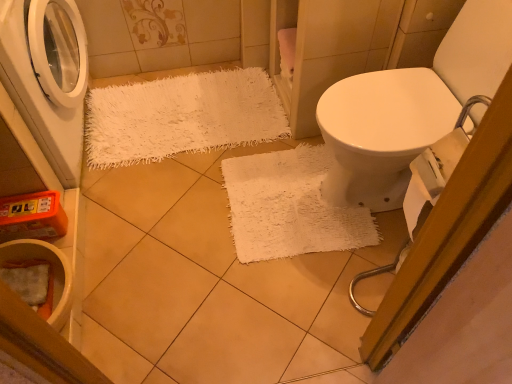
What do you see at coordinates (51, 273) in the screenshot?
I see `white ceramic toilet bowl at lower left` at bounding box center [51, 273].

Where is `white ceramic toilet bowl at lower left`? Image resolution: width=512 pixels, height=384 pixels. white ceramic toilet bowl at lower left is located at coordinates (51, 273).

Consider the image. Which of these two, white shaggy rug at upper left or white matte washing machine at left, stands taller?

With more height is white matte washing machine at left.

Is the surface of white shaggy rug at upper left in direct contact with white matte washing machine at left?

white shaggy rug at upper left is not next to white matte washing machine at left, and they're not touching.

From a real-world perspective, who is located lower, white shaggy rug at upper left or white matte washing machine at left?

white shaggy rug at upper left is physically lower.

From a real-world perspective, which object rests below the other?

In real-world perspective, white shaggy rug at upper left is lower.

Would you say white matte washing machine at left is a long distance from white shaggy rug at upper left?

No, white matte washing machine at left is not far from white shaggy rug at upper left.

Who is bigger, white matte washing machine at left or white shaggy rug at upper left?

white matte washing machine at left is bigger.

Who is shorter, white ceramic toilet bowl at lower left or white shaggy rug at upper left?

Standing shorter between the two is white shaggy rug at upper left.

From a real-world perspective, is white ceramic toilet bowl at lower left physically above white shaggy rug at upper left?

Yes, from a real-world perspective, white ceramic toilet bowl at lower left is over white shaggy rug at upper left

Which object is positioned more to the left, white ceramic toilet bowl at lower left or white shaggy rug at upper left?

From the viewer's perspective, white ceramic toilet bowl at lower left appears more on the left side.

Which point is more distant from viewer, (59, 282) or (91, 110)?

Point (91, 110)

Find the location of a particular element. This screenshot has width=512, height=384. toilet bowl located below the white shaggy rug at upper left (from the image's perspective) is located at coordinates (51, 273).

Is white shaggy rug at upper left aimed at white ceramic toilet bowl at lower left?

No, white shaggy rug at upper left does not turn towards white ceramic toilet bowl at lower left.

Is point (141, 127) closer to viewer compared to point (16, 242)?

No, (141, 127) is further to viewer.

Considering the positions of objects white shaggy rug at upper left and white ceramic toilet bowl at lower left in the image provided, who is behind, white shaggy rug at upper left or white ceramic toilet bowl at lower left?

white shaggy rug at upper left is further away from the camera.

Measure the distance between white ceramic toilet bowl at lower left and white matte washing machine at left.

white ceramic toilet bowl at lower left and white matte washing machine at left are 51.18 centimeters apart.

How different are the orientations of white ceramic toilet bowl at lower left and white matte washing machine at left in degrees?

The angle between the facing direction of white ceramic toilet bowl at lower left and the facing direction of white matte washing machine at left is 1.96 degrees.

Can white matte washing machine at left be found inside white ceramic toilet bowl at lower left?

No, white ceramic toilet bowl at lower left does not contain white matte washing machine at left.

Which object is more forward, white ceramic toilet bowl at lower left or white matte washing machine at left?

white matte washing machine at left.

Which object is more forward, white matte washing machine at left or white ceramic toilet bowl at lower left?

white matte washing machine at left.

Considering the relative sizes of white matte washing machine at left and white ceramic toilet bowl at lower left in the image provided, is white matte washing machine at left smaller than white ceramic toilet bowl at lower left?

No.

Which object is positioned more to the right, white matte washing machine at left or white ceramic toilet bowl at lower left?

From the viewer's perspective, white ceramic toilet bowl at lower left appears more on the right side.

Does point (38, 94) appear closer or farther from the camera than point (50, 311)?

Point (38, 94) is farther from the camera than point (50, 311).

This screenshot has height=384, width=512. In order to click on washing machine above the white shaggy rug at upper left (from a real-world perspective) in this screenshot , I will do `click(47, 76)`.

Locate an element on the screen. This screenshot has width=512, height=384. washing machine above the white shaggy rug at upper left (from the image's perspective) is located at coordinates (47, 76).

When comparing their distances from white shaggy rug at upper left, does white matte washing machine at left or white ceramic toilet bowl at lower left seem closer?

white matte washing machine at left.

Looking at the image, which one is located further to white matte washing machine at left, white ceramic toilet bowl at lower left or white shaggy rug at upper left?

white ceramic toilet bowl at lower left is further to white matte washing machine at left.

From the image, which object appears to be nearer to white ceramic toilet bowl at lower left, white matte washing machine at left or white shaggy rug at upper left?

white matte washing machine at left.

Looking at the image, which one is located closer to white ceramic toilet bowl at lower left, white shaggy rug at upper left or white matte washing machine at left?

white matte washing machine at left is positioned closer to the anchor white ceramic toilet bowl at lower left.

Looking at the image, which one is located closer to white matte washing machine at left, white shaggy rug at upper left or white ceramic toilet bowl at lower left?

white shaggy rug at upper left.

Which object lies nearer to the anchor point white shaggy rug at upper left, white ceramic toilet bowl at lower left or white matte washing machine at left?

white matte washing machine at left is positioned closer to the anchor white shaggy rug at upper left.

Locate an element on the screen. doormat between white matte washing machine at left and white ceramic toilet bowl at lower left from top to bottom is located at coordinates (181, 116).